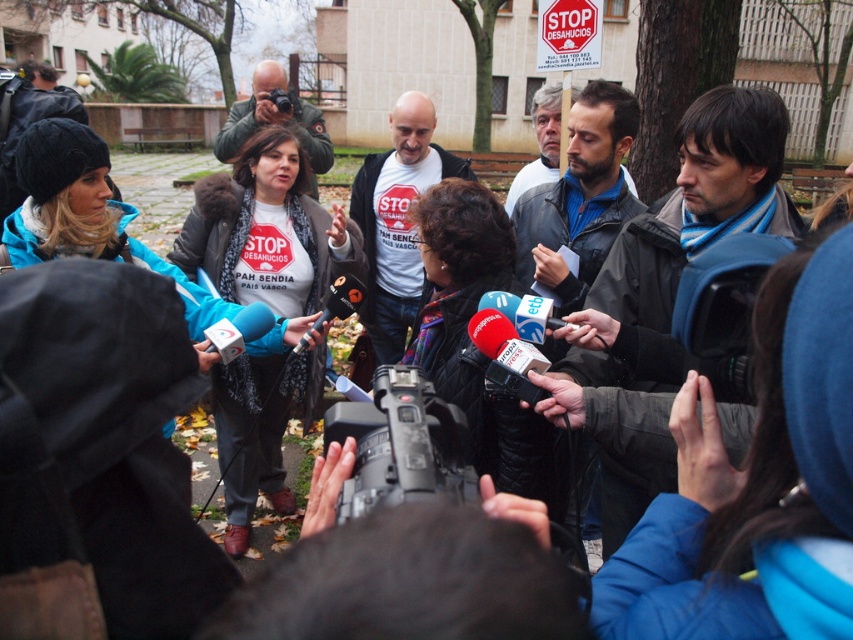
Question: Is black plastic video camera at center positioned before matte black camera at upper center?

Choices:
 (A) no
 (B) yes

Answer: (B)

Question: Can you confirm if black plastic video camera at center is smaller than matte black camera at upper center?

Choices:
 (A) yes
 (B) no

Answer: (B)

Question: Which object appears closest to the camera in this image?

Choices:
 (A) black plastic video camera at center
 (B) matte black camera at upper center

Answer: (A)

Question: Which of the following is the closest to the observer?

Choices:
 (A) matte black camera at upper center
 (B) black plastic video camera at center

Answer: (B)

Question: Does black plastic video camera at center appear under matte black camera at upper center?

Choices:
 (A) no
 (B) yes

Answer: (B)